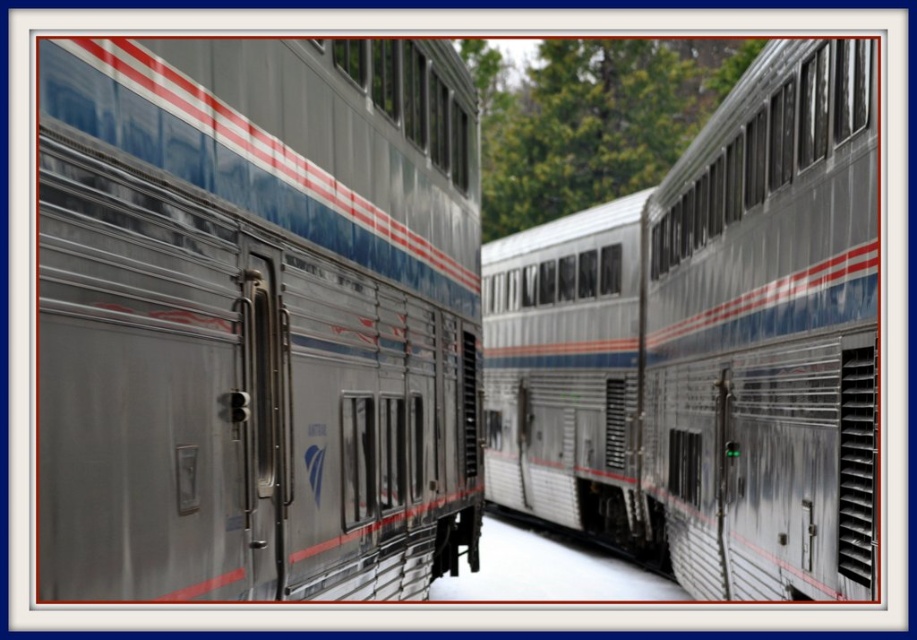
Question: Can you confirm if polished silver train at center is smaller than silver metallic train at center?

Choices:
 (A) yes
 (B) no

Answer: (A)

Question: Is polished silver train at center positioned at the back of silver metallic train at center?

Choices:
 (A) yes
 (B) no

Answer: (B)

Question: Is polished silver train at center below silver metallic train at center?

Choices:
 (A) no
 (B) yes

Answer: (A)

Question: Which of the following is the closest to the observer?

Choices:
 (A) (213, 472)
 (B) (642, 243)

Answer: (A)

Question: Which object appears closest to the camera in this image?

Choices:
 (A) silver metallic train at center
 (B) polished silver train at center

Answer: (B)